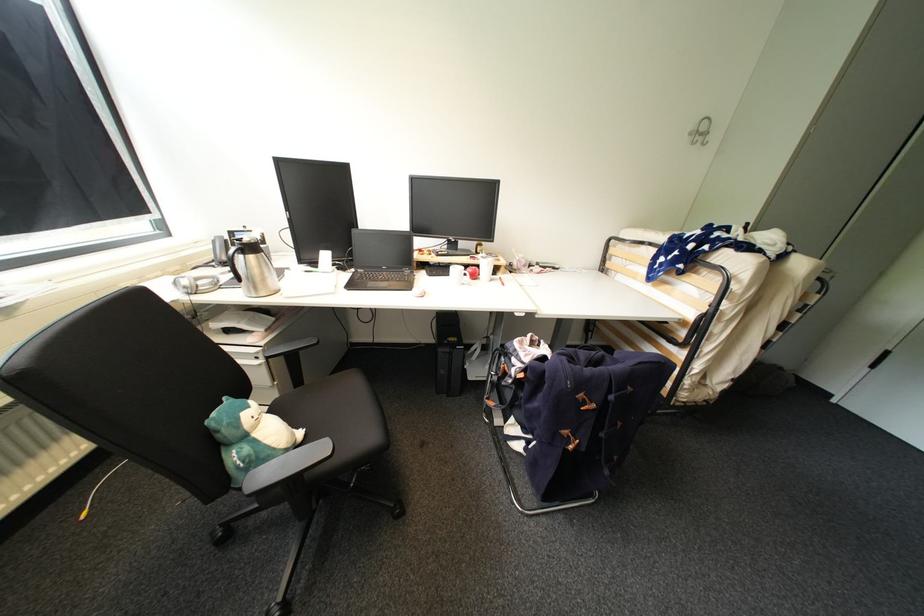
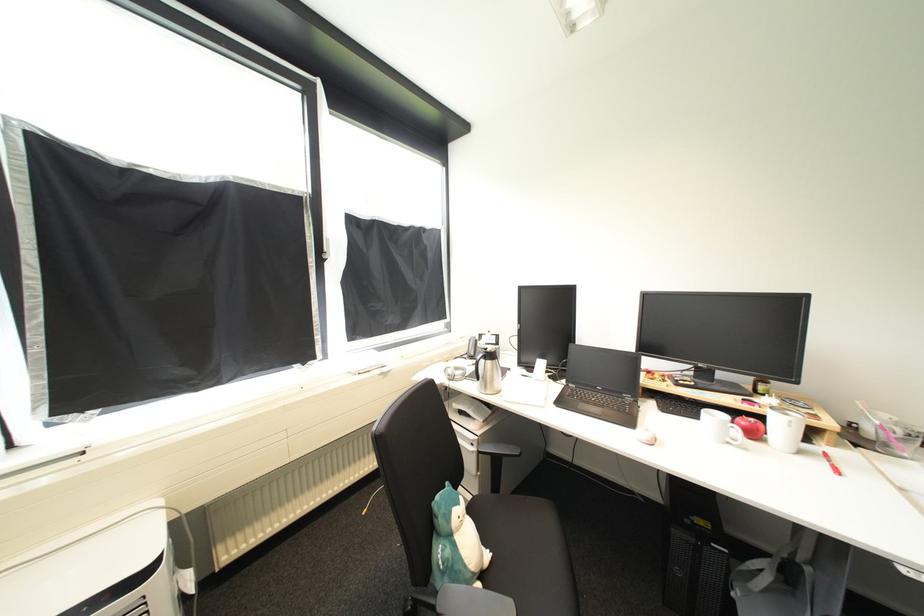
Locate, in the second image, the point that corresponds to point 197,294 in the first image.

(456, 381)